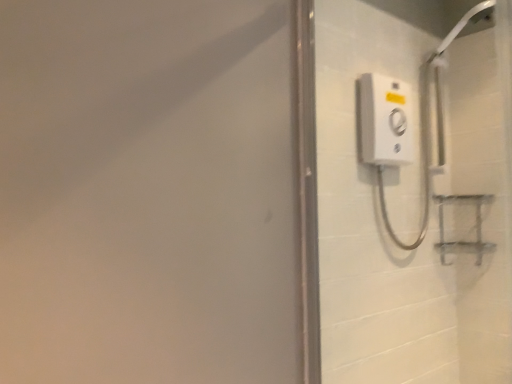
Question: From the image's perspective, is white plastic shower at upper right positioned above or below white plastic shower control at right?

Choices:
 (A) above
 (B) below

Answer: (A)

Question: Relative to white plastic shower control at right, is white plastic shower at upper right in front or behind?

Choices:
 (A) front
 (B) behind

Answer: (B)

Question: Would you say white plastic shower at upper right is to the left or to the right of white plastic shower control at right in the picture?

Choices:
 (A) left
 (B) right

Answer: (B)

Question: Do you think white plastic shower control at right is within white plastic shower at upper right, or outside of it?

Choices:
 (A) outside
 (B) inside

Answer: (A)

Question: Considering the positions of white plastic shower control at right and white plastic shower at upper right in the image, is white plastic shower control at right bigger or smaller than white plastic shower at upper right?

Choices:
 (A) big
 (B) small

Answer: (B)

Question: Considering the positions of point (434, 271) and point (450, 36), is point (434, 271) closer or farther from the camera than point (450, 36)?

Choices:
 (A) farther
 (B) closer

Answer: (A)

Question: Is white plastic shower control at right in front of or behind white plastic shower at upper right in the image?

Choices:
 (A) behind
 (B) front

Answer: (B)